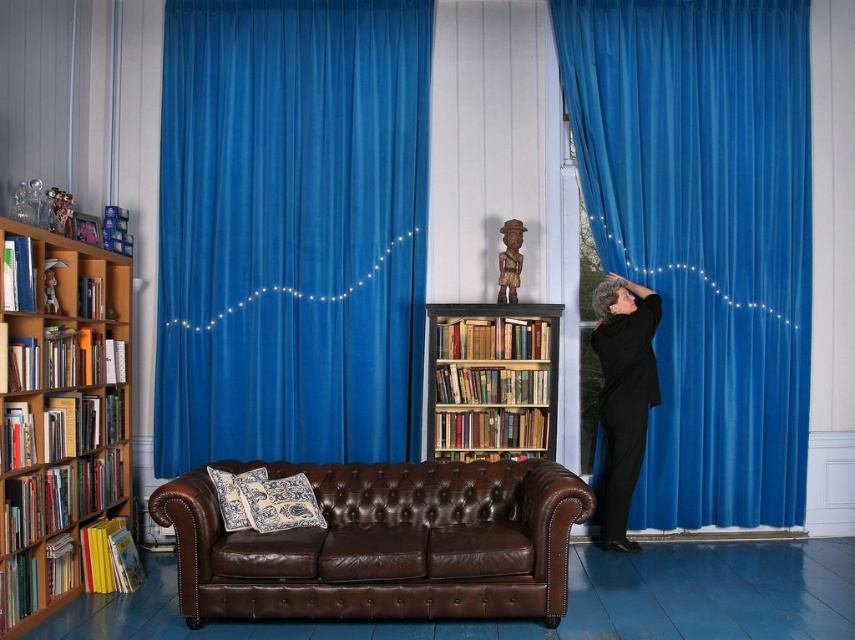
Which is more to the right, velvet blue curtain at right or brown leather couch at center?

Positioned to the right is velvet blue curtain at right.

Based on the photo, is velvet blue curtain at right above brown leather couch at center?

Yes.

Is point (646, 525) behind point (523, 513)?

Yes, it is behind point (523, 513).

The height and width of the screenshot is (640, 855). Identify the location of velvet blue curtain at right. (705, 234).

Which is below, brown leather couch at center or wooden bookcase at left?

Positioned lower is brown leather couch at center.

Based on the photo, is brown leather couch at center shorter than wooden bookcase at left?

Yes, brown leather couch at center is shorter than wooden bookcase at left.

Between point (171, 484) and point (91, 284), which one is positioned in front?

Point (171, 484) is more forward.

You are a GUI agent. You are given a task and a screenshot of the screen. Output one action in this format:
    pyautogui.click(x=<x>, y=<y>)
    Task: Click on the brown leather couch at center
    The image size is (855, 640).
    Given the screenshot: What is the action you would take?
    pyautogui.click(x=385, y=545)

Between wooden bookcase at left and wooden bookcase at center, which one has less height?

Standing shorter between the two is wooden bookcase at center.

Who is lower down, wooden bookcase at left or wooden bookcase at center?

wooden bookcase at left is lower down.

The height and width of the screenshot is (640, 855). Describe the element at coordinates (57, 410) in the screenshot. I see `wooden bookcase at left` at that location.

Where is `wooden bookcase at left`? The width and height of the screenshot is (855, 640). wooden bookcase at left is located at coordinates (57, 410).